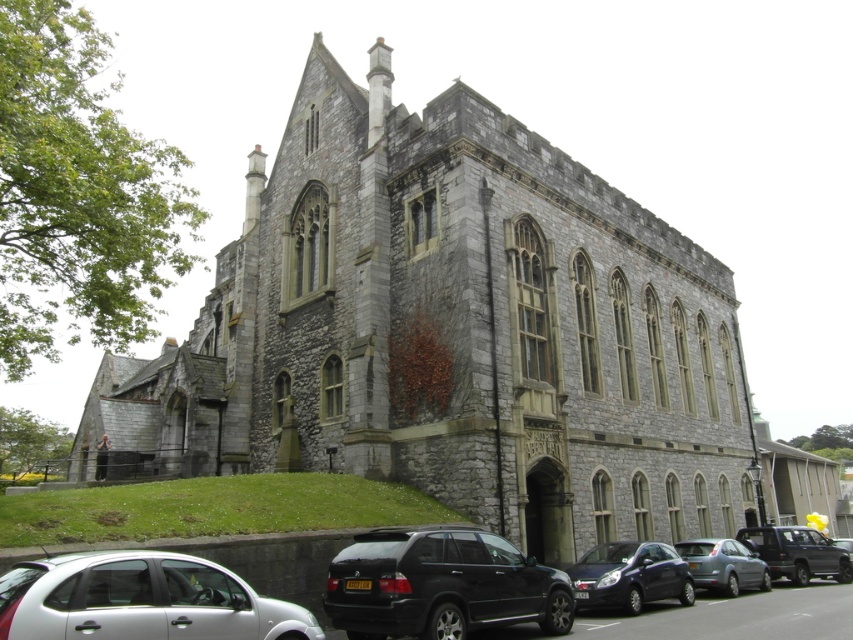
Is white matte hatchback at lower left positioned behind dark blue metallic car at lower center?

No, white matte hatchback at lower left is in front of dark blue metallic car at lower center.

Where is `white matte hatchback at lower left`? white matte hatchback at lower left is located at coordinates (141, 600).

Is black matte suv at lower center thinner than dark blue metallic car at lower center?

In fact, black matte suv at lower center might be wider than dark blue metallic car at lower center.

Is black matte suv at lower center above dark blue metallic car at lower center?

Yes, black matte suv at lower center is above dark blue metallic car at lower center.

Locate an element on the screen. The image size is (853, 640). black matte suv at lower center is located at coordinates (440, 584).

Describe the element at coordinates (630, 577) in the screenshot. The height and width of the screenshot is (640, 853). I see `dark blue metallic car at lower center` at that location.

Does dark blue metallic car at lower center have a greater height compared to metallic gray suv at lower right?

No, dark blue metallic car at lower center is not taller than metallic gray suv at lower right.

Locate an element on the screen. The image size is (853, 640). dark blue metallic car at lower center is located at coordinates pos(630,577).